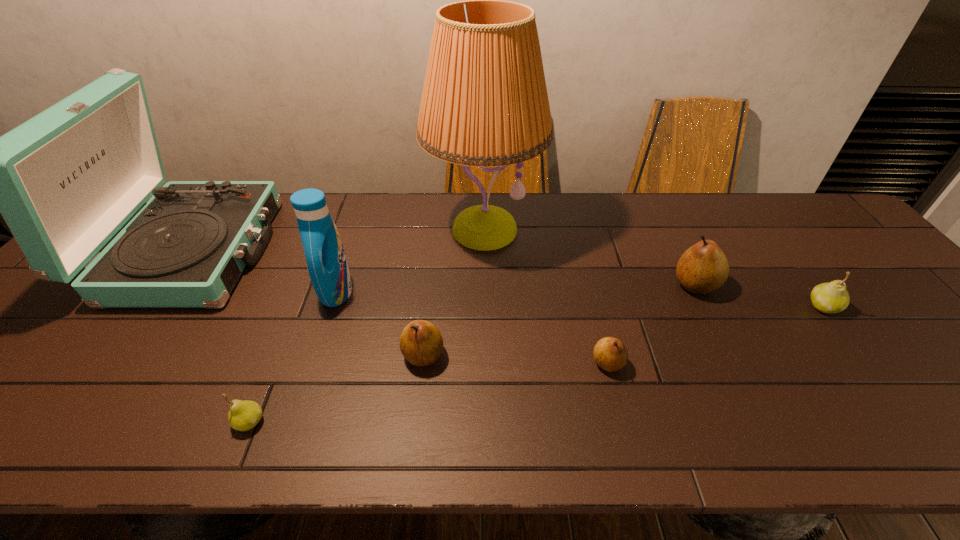
I want to click on vacant region at the near edge of the desktop, so click(361, 417).

In order to click on free space at the left edge in this screenshot , I will do `click(57, 303)`.

Identify the location of free space at the right edge of the desktop. (893, 347).

Find the location of `vacant area at the far right corner`. vacant area at the far right corner is located at coordinates (803, 200).

Locate an element on the screen. unoccupied position between the nearest pear and the leftmost object is located at coordinates (222, 336).

This screenshot has height=540, width=960. Find the location of `free space that is in between the smallest brown pear and the third object from left to right`. free space that is in between the smallest brown pear and the third object from left to right is located at coordinates (472, 327).

Where is `vacant region between the leftmost brown pear and the lamp`? vacant region between the leftmost brown pear and the lamp is located at coordinates (453, 292).

Identify the location of empty space that is in between the sixth object from right to left and the lamp. Image resolution: width=960 pixels, height=540 pixels. (410, 260).

Locate an element on the screen. Image resolution: width=960 pixels, height=540 pixels. vacant area that lies between the record player and the rightmost pear is located at coordinates (x=508, y=279).

Where is `blank region between the second brown pear from left to right and the third object from left to right`? This screenshot has height=540, width=960. blank region between the second brown pear from left to right and the third object from left to right is located at coordinates (472, 327).